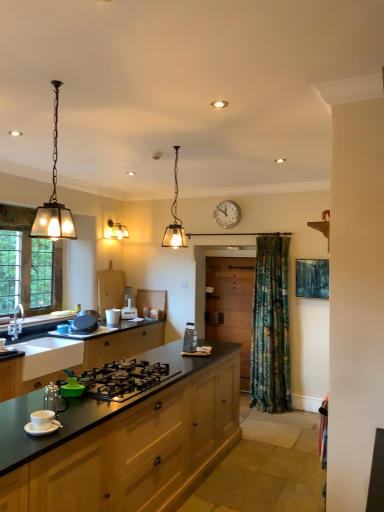
Where is `space that is in front of metallic silver tea pot at lower left`? This screenshot has width=384, height=512. space that is in front of metallic silver tea pot at lower left is located at coordinates (52, 434).